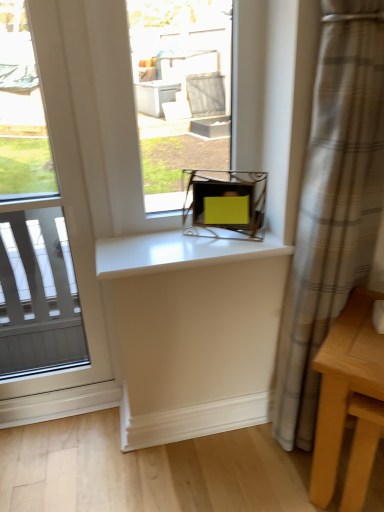
Image resolution: width=384 pixels, height=512 pixels. Find the location of `vacant area that lies between plaid fabric curtain at right and light wood table at lower right`. vacant area that lies between plaid fabric curtain at right and light wood table at lower right is located at coordinates (291, 472).